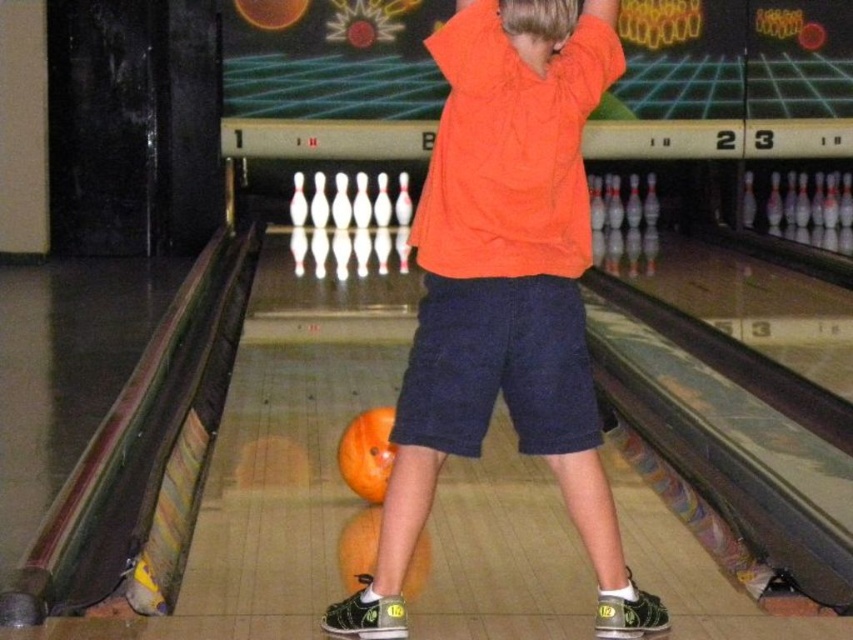
Question: Which object appears closest to the camera in this image?

Choices:
 (A) orange matte bowling ball at center
 (B) orange cotton shirt at center
 (C) orange matte bowling ball at lower center

Answer: (B)

Question: Does orange cotton shirt at center appear over orange matte bowling ball at center?

Choices:
 (A) no
 (B) yes

Answer: (B)

Question: Which object appears farthest from the camera in this image?

Choices:
 (A) orange matte bowling ball at center
 (B) orange cotton shirt at center
 (C) orange matte bowling ball at lower center

Answer: (A)

Question: From the image, what is the correct spatial relationship of orange cotton shirt at center in relation to orange matte bowling ball at center?

Choices:
 (A) above
 (B) below

Answer: (A)

Question: Which of the following is the closest to the observer?

Choices:
 (A) (428, 376)
 (B) (363, 524)
 (C) (357, 451)

Answer: (A)

Question: Does orange matte bowling ball at center appear on the right side of orange matte bowling ball at lower center?

Choices:
 (A) no
 (B) yes

Answer: (A)